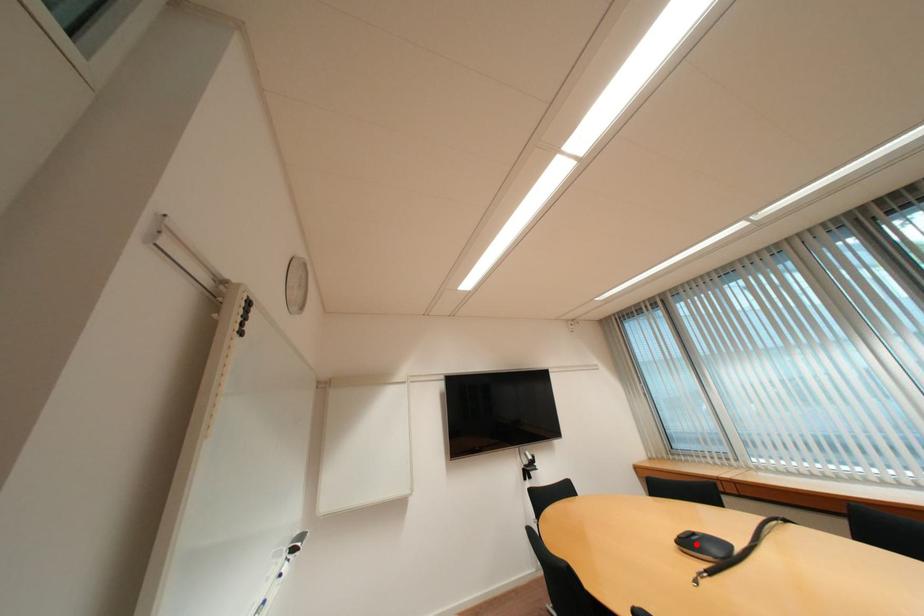
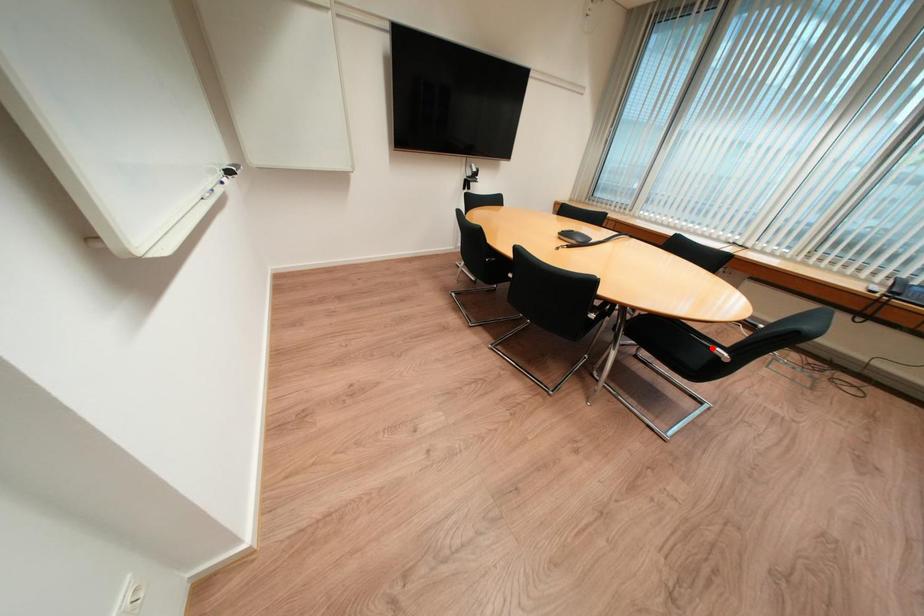
I am providing you with two images of the same scene from different viewpoints. A red point is marked on the first image and another point is marked on the second image. Is the red point in image1 aligned with the point shown in image2?

No